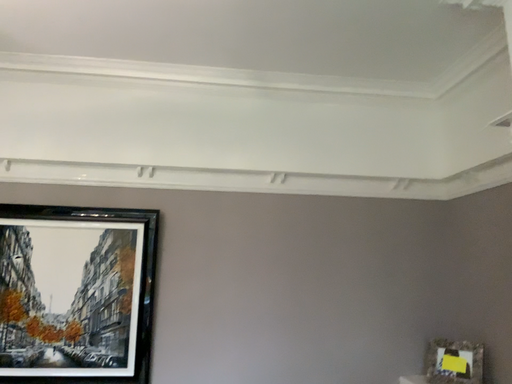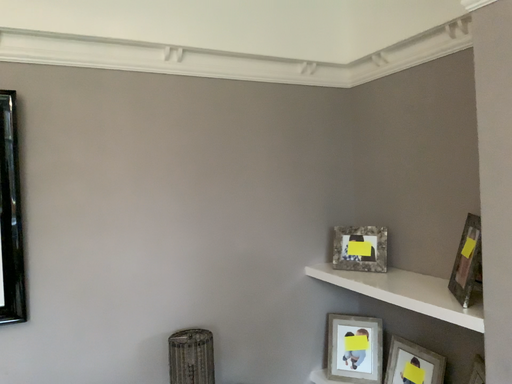
Question: Which way did the camera rotate in the video?

Choices:
 (A) rotated right
 (B) rotated left

Answer: (A)